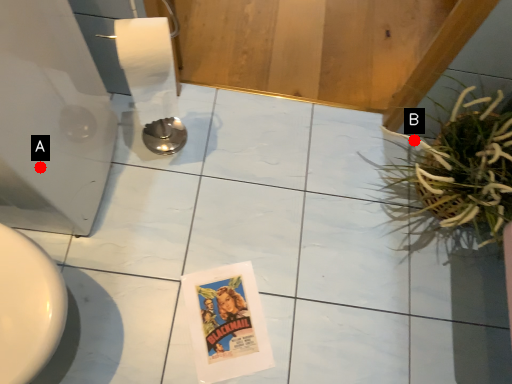
Question: Two points are circled on the image, labeled by A and B beside each circle. Which point appears farthest from the camera in this image?

Choices:
 (A) A is further
 (B) B is further

Answer: (B)